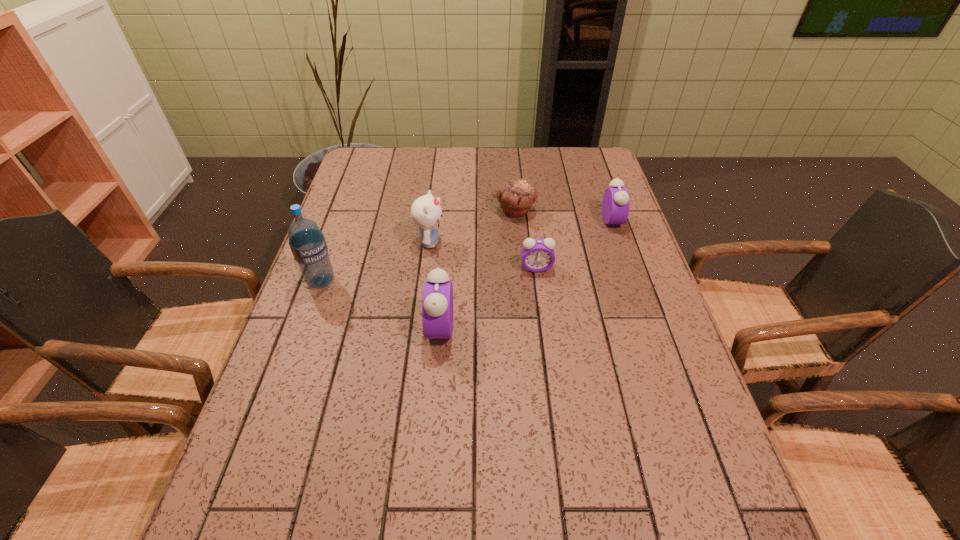
This screenshot has height=540, width=960. I want to click on vacant space located 0.110m on the face of the leftmost alarm clock, so click(382, 328).

Find the location of `vacant space positioned on the face of the leftmost alarm clock`. vacant space positioned on the face of the leftmost alarm clock is located at coordinates (302, 328).

This screenshot has width=960, height=540. I want to click on free location located on the face of the leftmost alarm clock, so click(x=345, y=328).

Identify the location of free space located on the face of the second alarm clock from right to left. (544, 328).

Where is `free space located 0.290m on the front of the tallest object`? Image resolution: width=960 pixels, height=540 pixels. free space located 0.290m on the front of the tallest object is located at coordinates (281, 393).

The height and width of the screenshot is (540, 960). Identify the location of vacant space situated 0.160m on the front of the muffin. (520, 257).

The width and height of the screenshot is (960, 540). I want to click on vacant space positioned on the front-facing side of the kitten, so (556, 242).

The width and height of the screenshot is (960, 540). Find the location of `object that is at the left edge`. object that is at the left edge is located at coordinates (307, 243).

You are a GUI agent. You are given a task and a screenshot of the screen. Output one action in this format:
    pyautogui.click(x=<x>, y=<y>)
    Task: Click on the object located at the right edge
    The height and width of the screenshot is (540, 960).
    Given the screenshot: What is the action you would take?
    pyautogui.click(x=615, y=207)

Locate an element on the screen. This screenshot has width=960, height=540. free space at the far edge of the desktop is located at coordinates (522, 157).